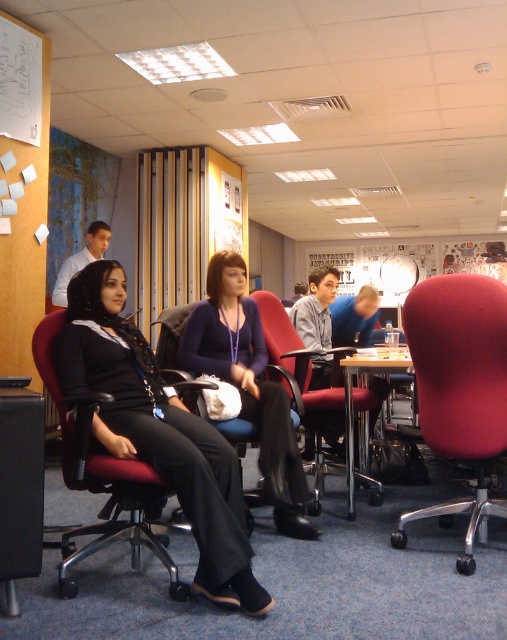
Does point (416, 337) come in front of point (352, 490)?

Yes.

Does smooth red swivel chair at right appear under wooden table at center?

Incorrect, smooth red swivel chair at right is not positioned below wooden table at center.

Which is behind, point (454, 429) or point (344, 397)?

Point (344, 397)

Where is `smooth red swivel chair at right`? The image size is (507, 640). smooth red swivel chair at right is located at coordinates (459, 388).

Is point (164, 541) farther from camera compared to point (92, 253)?

No, it is in front of (92, 253).

Is matte black office chair at left closer to camera compared to matte black shirt at left?

Yes, matte black office chair at left is closer to the viewer.

I want to click on matte black office chair at left, so click(x=102, y=477).

Find the location of a particular element. This screenshot has width=507, height=640. matte black office chair at left is located at coordinates (102, 477).

Can you confirm if matte black office chair at left is positioned above matte plastic chair at center?

No.

Can you confirm if matte black office chair at left is positioned to the right of matte plastic chair at center?

No, matte black office chair at left is not to the right of matte plastic chair at center.

Is point (39, 356) more distant than point (307, 365)?

No, it is in front of (307, 365).

Locate an element on the screen. Image resolution: width=507 pixels, height=640 pixels. matte black office chair at left is located at coordinates (102, 477).